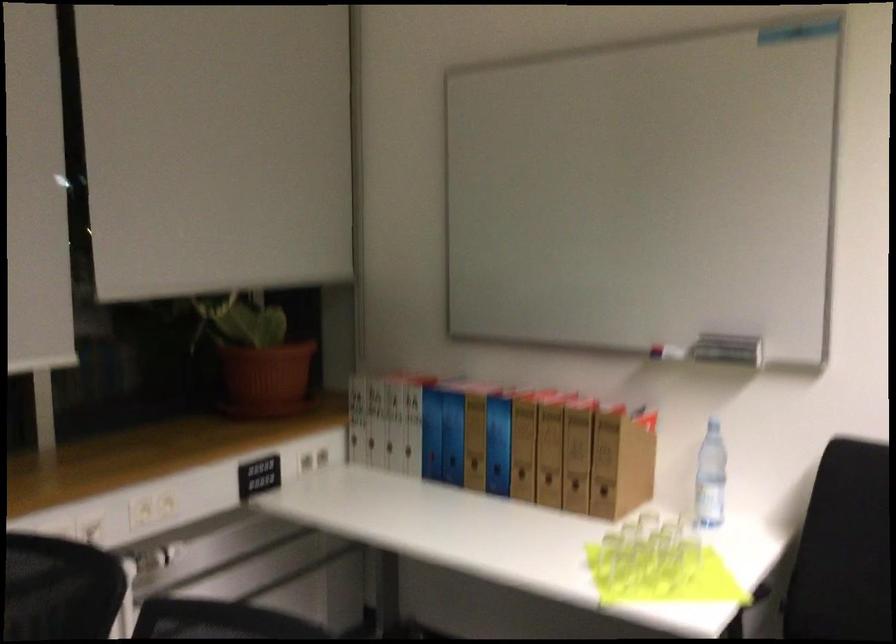
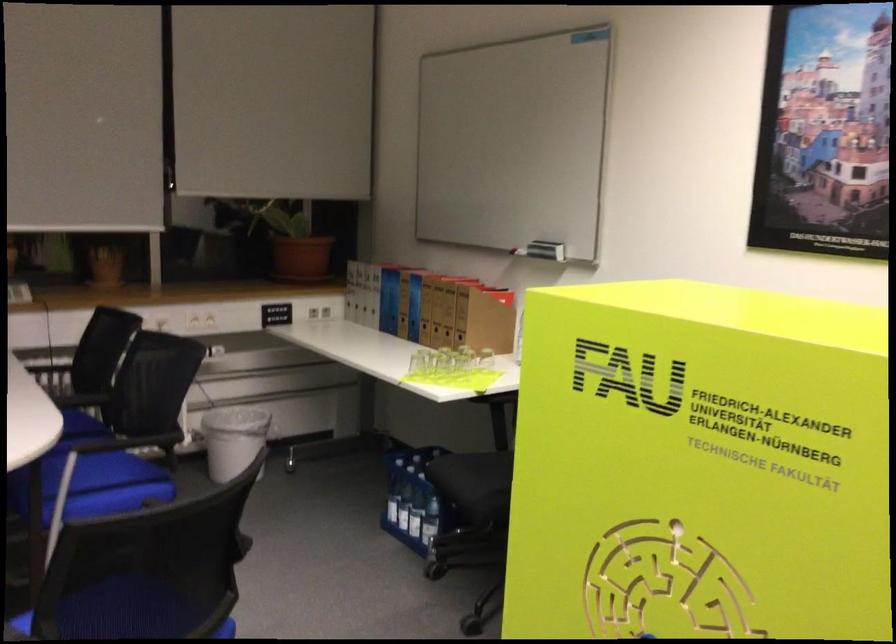
The point at (615,565) is marked in the first image. Where is the corresponding point in the second image?

(418, 363)